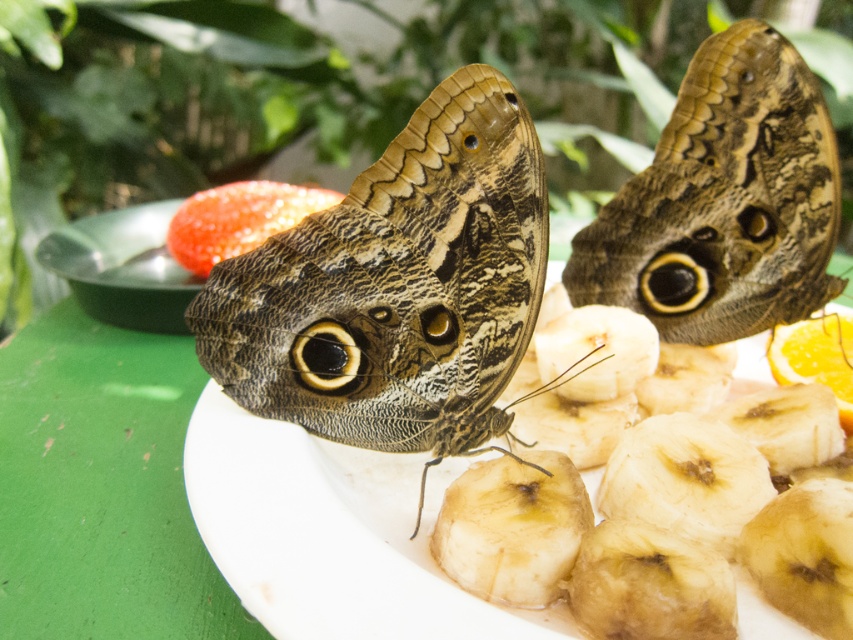
You are a child who wants to catch both butterflies without scaring them. The brown textured butterfly at center is 33.79 inches away from the other butterfly. If you can reach 30 inches in one try, will you be able to catch both butterflies in one try?

The brown textured butterfly at center and the other butterfly are 33.79 inches apart. Since you can only reach 30 inches in one try, you will not be able to catch both butterflies in a single attempt.

You are a chef preparing a decorative fruit platter and notice two items on the table. You see the brown textured butterfly at center and the smooth white plate at center. Which item is positioned higher in the scene?

The brown textured butterfly at center is above the smooth white plate at center, so it is positioned higher in the scene.

You are a chef preparing a fruit platter and need to place the orangesmoothfruit at right onto the smooth white plate at center. The platter requires the fruit to be exactly 20 inches away from the plate. Can you place it correctly?

The smooth white plate at center and orangesmoothfruit at right are 20.52 inches apart from each other. Since 20.52 inches is slightly more than 20 inches, the orangesmoothfruit at right is placed just beyond the required distance. To meet the exact requirement, you would need to move it about half an inch closer to the smooth white plate at center.